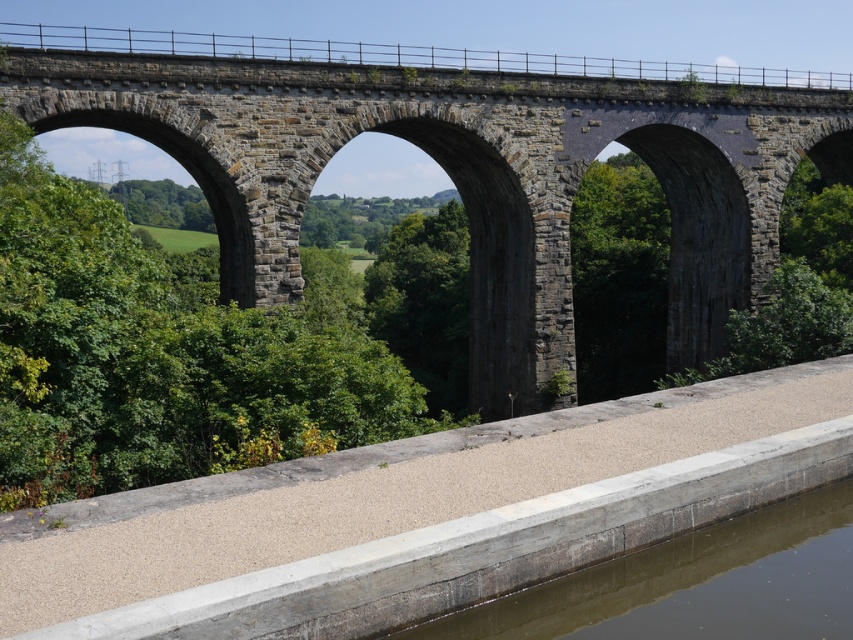
Question: Which point is closer to the camera?

Choices:
 (A) (538, 93)
 (B) (608, 593)

Answer: (B)

Question: Is dark gray stone bridge at center to the left of brown concrete river at lower center from the viewer's perspective?

Choices:
 (A) no
 (B) yes

Answer: (A)

Question: Is the position of dark gray stone bridge at center less distant than that of brown concrete river at lower center?

Choices:
 (A) no
 (B) yes

Answer: (A)

Question: Is dark gray stone bridge at center below brown concrete river at lower center?

Choices:
 (A) yes
 (B) no

Answer: (B)